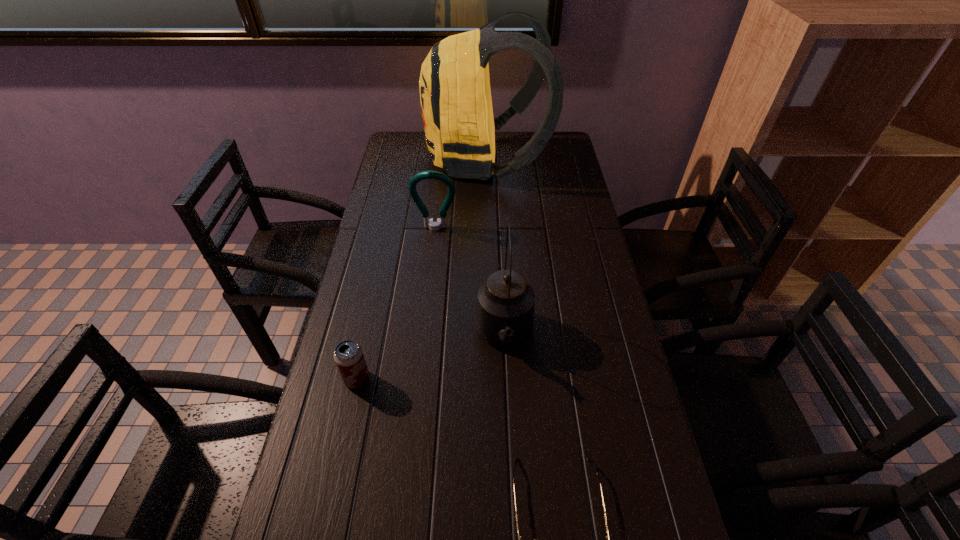
The height and width of the screenshot is (540, 960). I want to click on vacant area located spout on the second tallest object, so click(x=511, y=469).

Identify the location of vacant area situated 0.060m at the jaws of the third tallest object. The height and width of the screenshot is (540, 960). (433, 246).

At what (x,y) coordinates should I click in order to perform the action: click on free region located 0.150m on the back of the second shortest object. Please return your answer as a coordinate pair (x, y). The image size is (960, 540). Looking at the image, I should click on (370, 320).

Identify the location of object that is at the far edge. The width and height of the screenshot is (960, 540). (455, 95).

Locate an element on the screen. This screenshot has height=540, width=960. backpack located at the left edge is located at coordinates (455, 95).

Locate an element on the screen. This screenshot has height=540, width=960. bottle opener that is positioned at the left edge is located at coordinates (441, 222).

At what (x,y) coordinates should I click in order to perform the action: click on beer can positioned at the left edge. Please return your answer as a coordinate pair (x, y). This screenshot has width=960, height=540. Looking at the image, I should click on (348, 355).

You are a GUI agent. You are given a task and a screenshot of the screen. Output one action in this format:
    pyautogui.click(x=<x>, y=<y>)
    Task: Click on the object at the right edge
    The image size is (960, 540).
    Given the screenshot: What is the action you would take?
    pyautogui.click(x=455, y=95)

This screenshot has height=540, width=960. I want to click on object that is at the far left corner, so click(x=455, y=95).

The height and width of the screenshot is (540, 960). What are the coordinates of `object that is at the far right corner` in the screenshot? It's located at (455, 95).